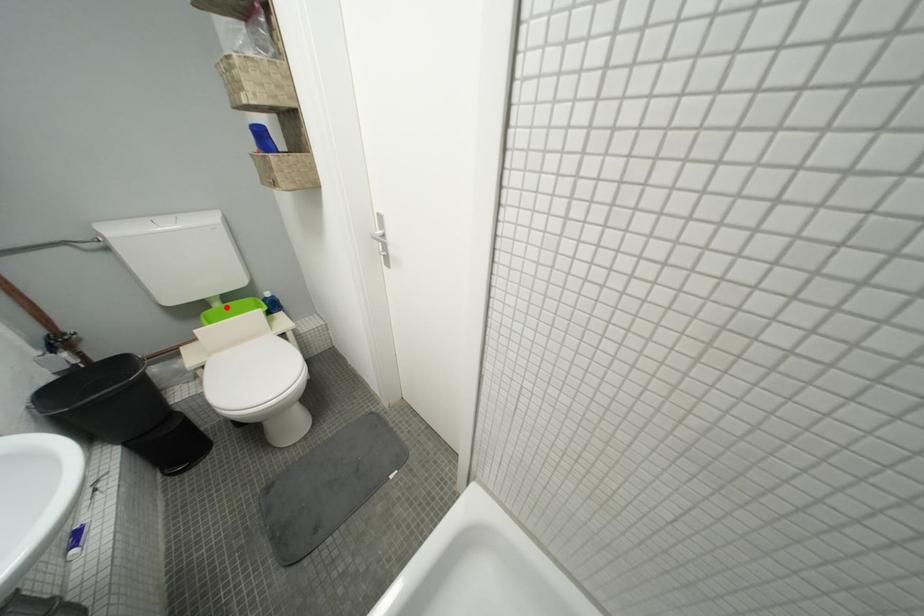
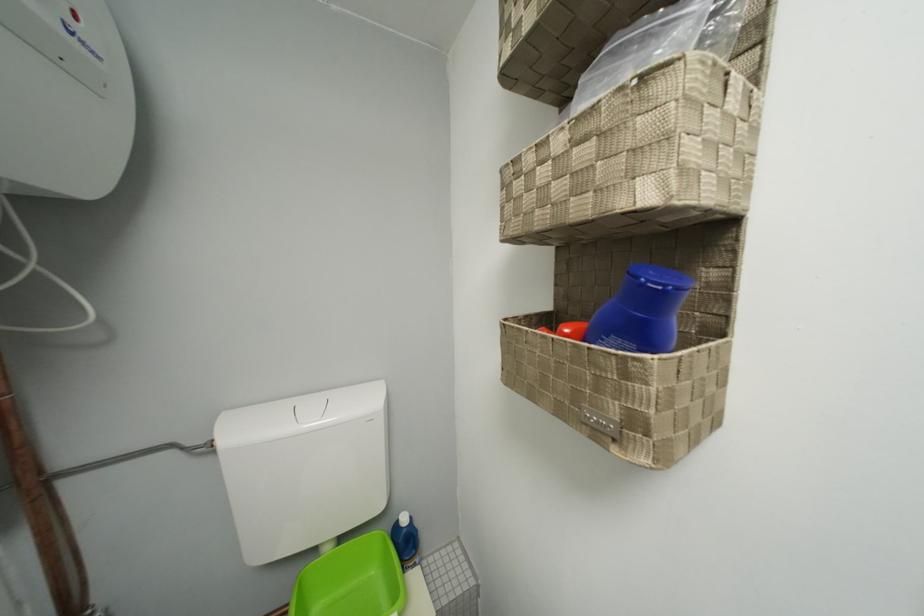
In the second image, find the point that corresponds to the highlighted location in the first image.

(335, 552)